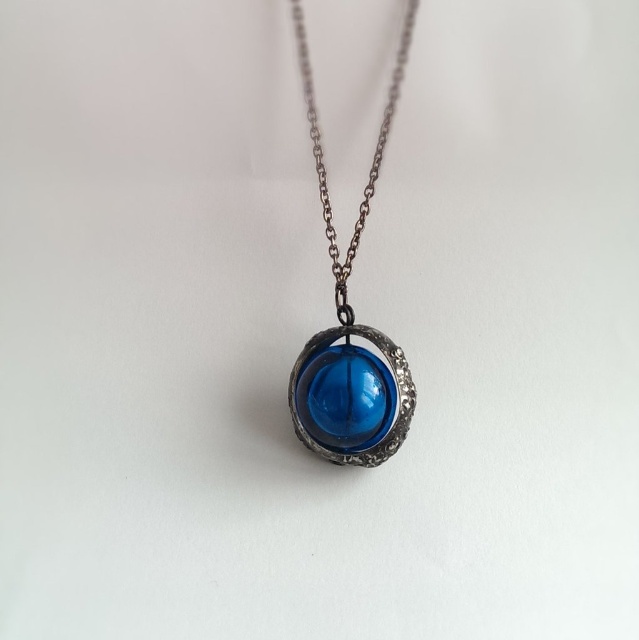
Can you confirm if transparent glass sphere at center is positioned above gunmetal chain at center?

Actually, transparent glass sphere at center is below gunmetal chain at center.

Can you confirm if transparent glass sphere at center is positioned below gunmetal chain at center?

Correct, transparent glass sphere at center is located below gunmetal chain at center.

Where is `transparent glass sphere at center`? transparent glass sphere at center is located at coordinates (350, 396).